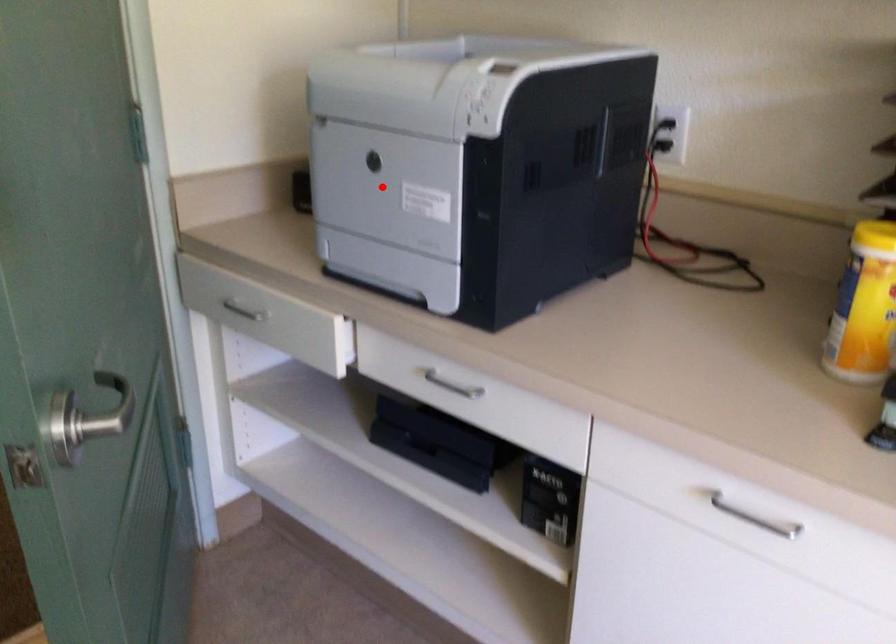
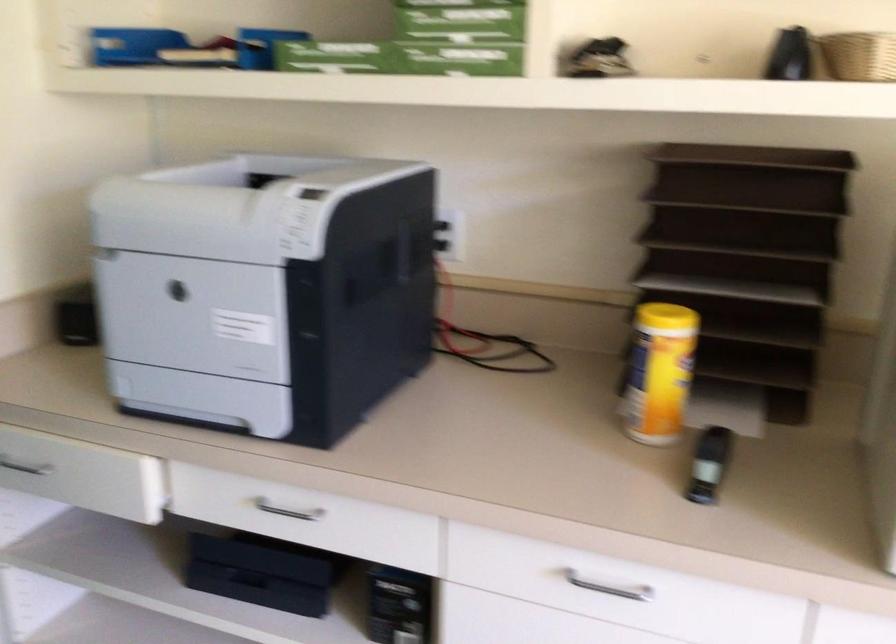
The point at the highlighted location is marked in the first image. Where is the corresponding point in the second image?

(194, 315)